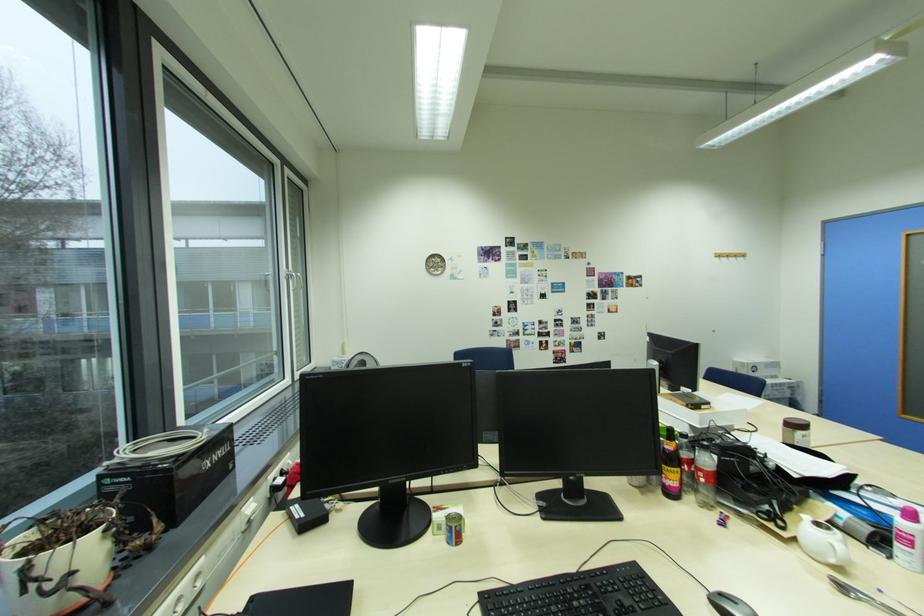
Find where to lift the pink spray bottle. Please return your answer as a coordinate pair (x, y).

(907, 539)